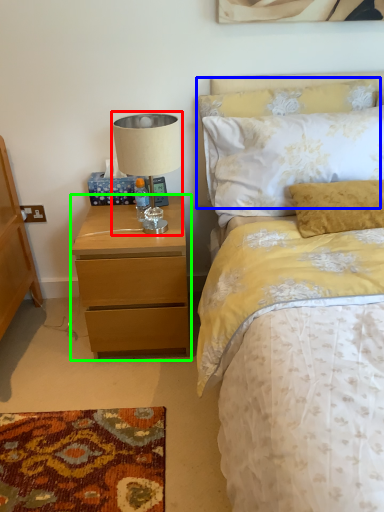
Question: Considering the real-world distances, which object is closest to table lamp (highlighted by a red box)? pillow (highlighted by a blue box) or nightstand (highlighted by a green box).

Choices:
 (A) pillow
 (B) nightstand

Answer: (B)